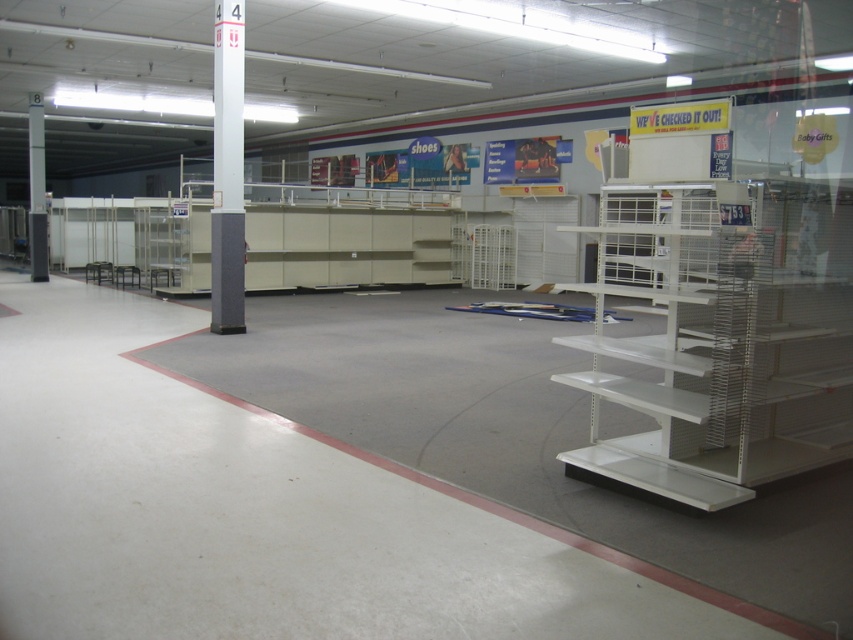
Question: Which object is closer to the camera taking this photo?

Choices:
 (A) white textured pole at center
 (B) white metal shelf at right
 (C) gray concrete pillar at left

Answer: (B)

Question: Which object is closer to the camera taking this photo?

Choices:
 (A) white textured pole at center
 (B) white metal shelf at right
 (C) gray concrete pillar at left

Answer: (B)

Question: Estimate the real-world distances between objects in this image. Which object is closer to the white metal shelf at right?

Choices:
 (A) gray concrete pillar at left
 (B) white textured pole at center

Answer: (B)

Question: Is white textured pole at center further to camera compared to gray concrete pillar at left?

Choices:
 (A) yes
 (B) no

Answer: (B)

Question: Can you confirm if white metal shelf at right is smaller than gray concrete pillar at left?

Choices:
 (A) no
 (B) yes

Answer: (B)

Question: Does white metal shelf at right appear under gray concrete pillar at left?

Choices:
 (A) yes
 (B) no

Answer: (A)